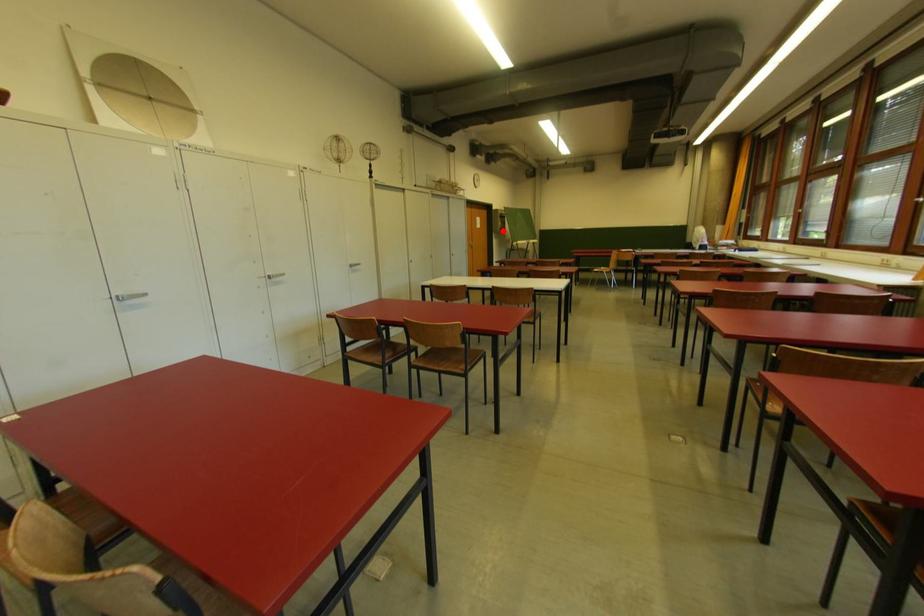
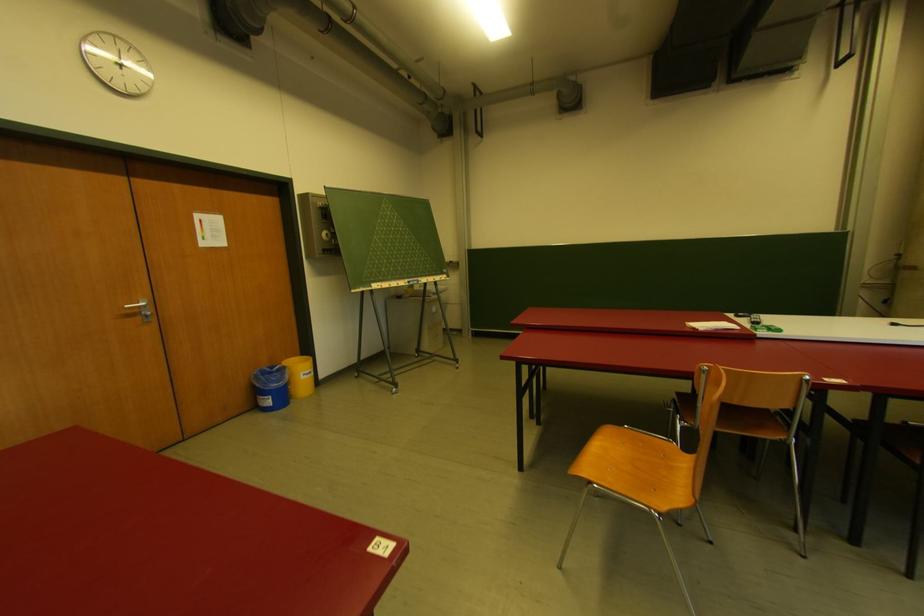
The point at the highlighted location is marked in the first image. Where is the corresponding point in the second image?

(326, 252)